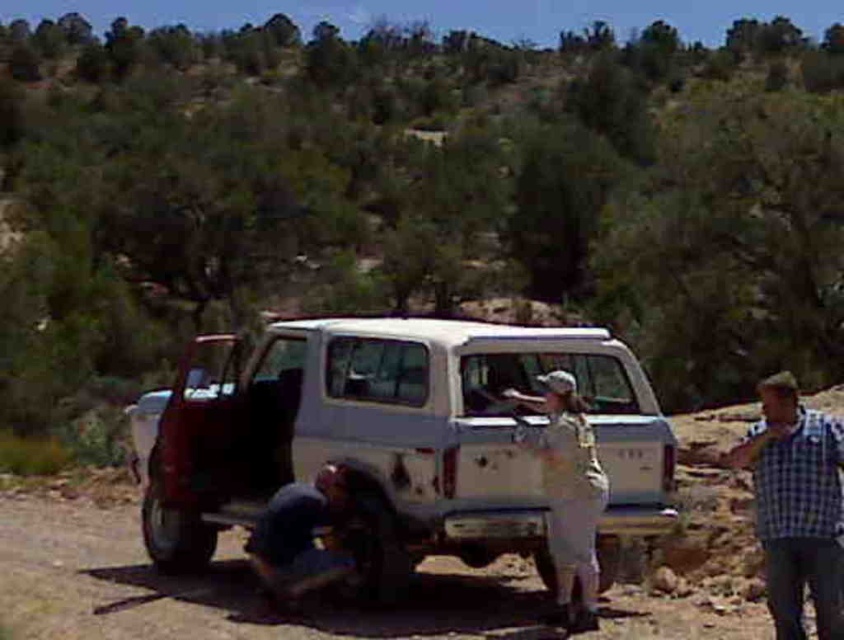
Question: Considering the real-world distances, which object is closest to the white matte jeep at center?

Choices:
 (A) blue fabric squat at lower center
 (B) dirt field at lower center

Answer: (A)

Question: Is white matte jeep at center thinner than dirt field at lower center?

Choices:
 (A) no
 (B) yes

Answer: (B)

Question: Which of the following is the closest to the observer?

Choices:
 (A) dirt field at lower center
 (B) white matte jeep at center

Answer: (A)

Question: Which object appears closest to the camera in this image?

Choices:
 (A) blue checkered shirt at right
 (B) white matte jeep at center
 (C) dirt field at lower center
 (D) blue fabric squat at lower center

Answer: (A)

Question: Does white matte jeep at center lie in front of dirt field at lower center?

Choices:
 (A) yes
 (B) no

Answer: (B)

Question: Does white matte jeep at center have a larger size compared to blue fabric squat at lower center?

Choices:
 (A) yes
 (B) no

Answer: (B)